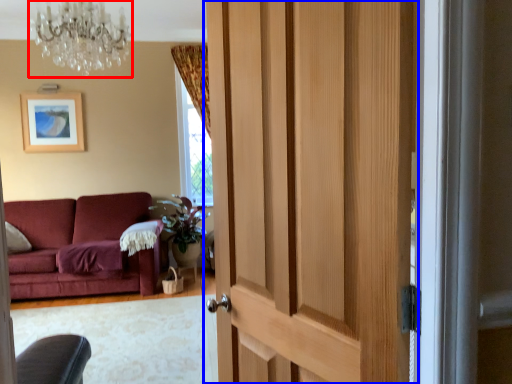
Question: Which object is further to the camera taking this photo, chandelier (highlighted by a red box) or door (highlighted by a blue box)?

Choices:
 (A) chandelier
 (B) door

Answer: (A)